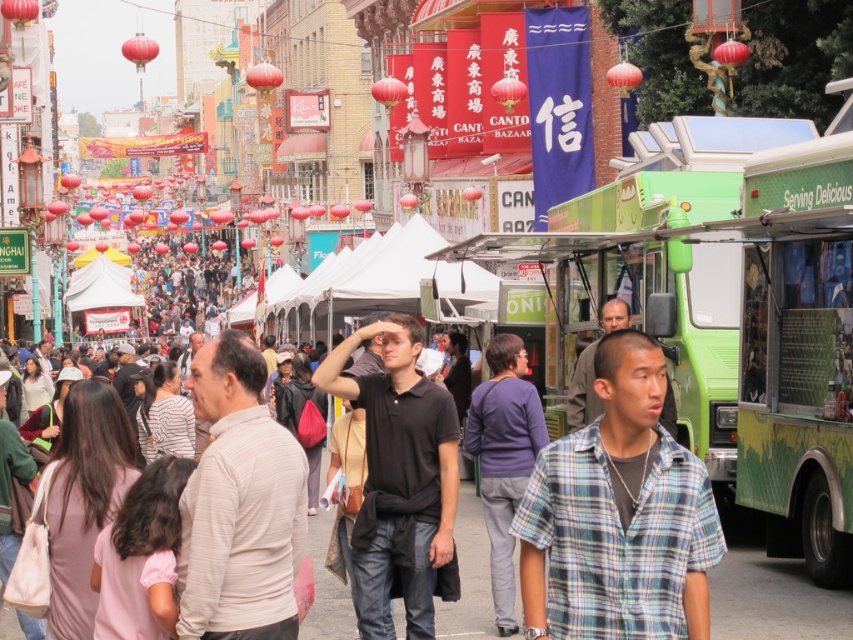
Who is more distant from viewer, [434,525] or [514,625]?

The point [514,625] is more distant.

This screenshot has width=853, height=640. Describe the element at coordinates (399, 480) in the screenshot. I see `black matte shirt at center` at that location.

Which is behind, point (349, 388) or point (508, 451)?

The point (508, 451) is more distant.

Find the location of a particular element. The height and width of the screenshot is (640, 853). black matte shirt at center is located at coordinates tap(399, 480).

Which is below, light beige striped shirt at center or black matte shirt at center?

black matte shirt at center

Who is shorter, light beige striped shirt at center or black matte shirt at center?

Standing shorter between the two is light beige striped shirt at center.

Identify the location of light beige striped shirt at center. The width and height of the screenshot is (853, 640). (239, 504).

The image size is (853, 640). What do you see at coordinates (735, 314) in the screenshot?
I see `green matte food truck at center` at bounding box center [735, 314].

Which is more to the right, green matte food truck at center or light beige striped shirt at center?

green matte food truck at center is more to the right.

Describe the element at coordinates (735, 314) in the screenshot. This screenshot has height=640, width=853. I see `green matte food truck at center` at that location.

Locate an element on the screen. green matte food truck at center is located at coordinates (735, 314).